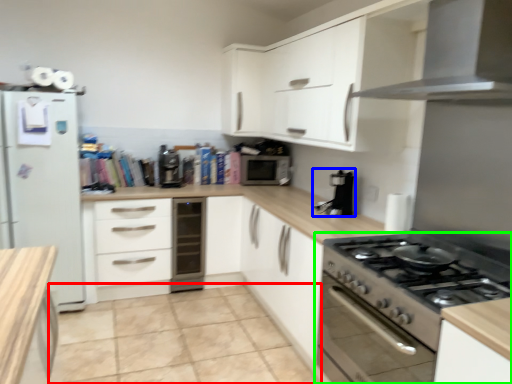
Question: Considering the real-world distances, which object is farthest from tile (highlighted by a red box)? coffee machine (highlighted by a blue box) or kitchen appliance (highlighted by a green box)?

Choices:
 (A) coffee machine
 (B) kitchen appliance

Answer: (A)